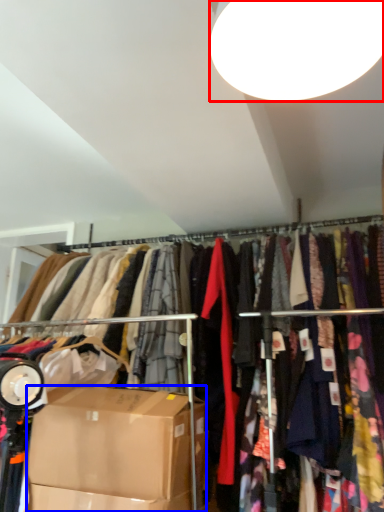
Question: Among these objects, which one is nearest to the camera, lamp (highlighted by a red box) or box (highlighted by a blue box)?

Choices:
 (A) lamp
 (B) box

Answer: (A)